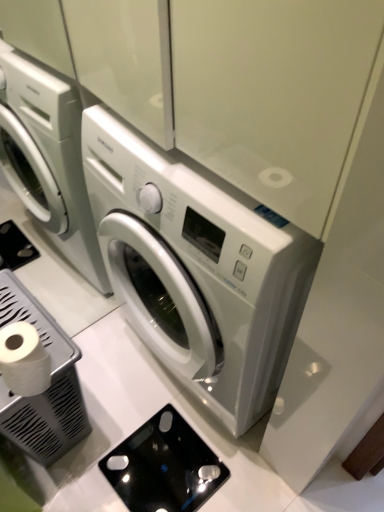
At what (x,y) coordinates should I click in order to perform the action: click on free location above black glass scale at lower center, acting as the 2th appliance starting from the left (from a real-world perspective). Please return your answer as a coordinate pair (x, y). This screenshot has height=512, width=384. Looking at the image, I should click on (166, 464).